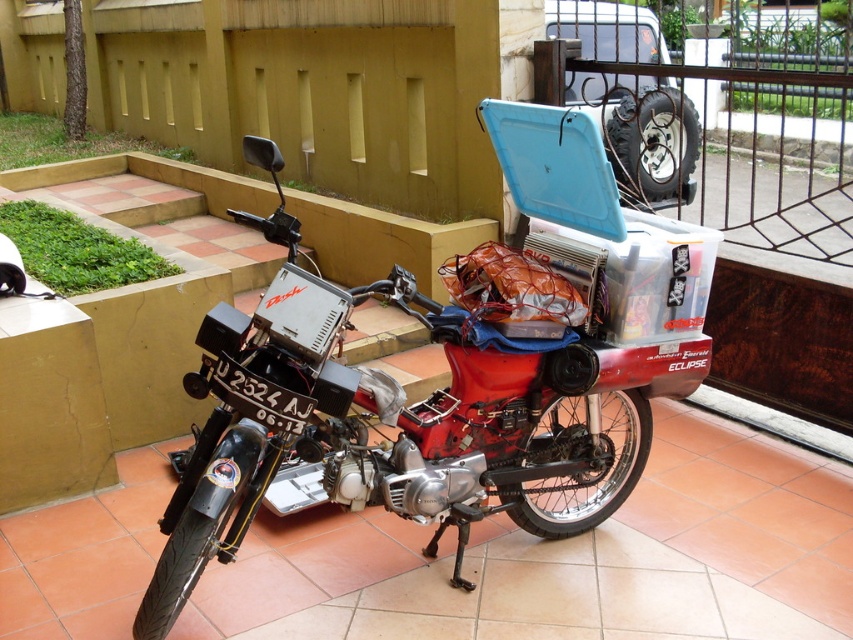
Question: Which object is closer to the camera taking this photo?

Choices:
 (A) black metal fence at upper right
 (B) red matte motorcycle at center

Answer: (B)

Question: Which of the following is the farthest from the observer?

Choices:
 (A) (721, 134)
 (B) (531, 516)

Answer: (A)

Question: Is red matte motorcycle at center below black metal fence at upper right?

Choices:
 (A) yes
 (B) no

Answer: (A)

Question: Can you confirm if red matte motorcycle at center is positioned to the right of black metal fence at upper right?

Choices:
 (A) yes
 (B) no

Answer: (B)

Question: Where is red matte motorcycle at center located in relation to black metal fence at upper right in the image?

Choices:
 (A) above
 (B) below

Answer: (B)